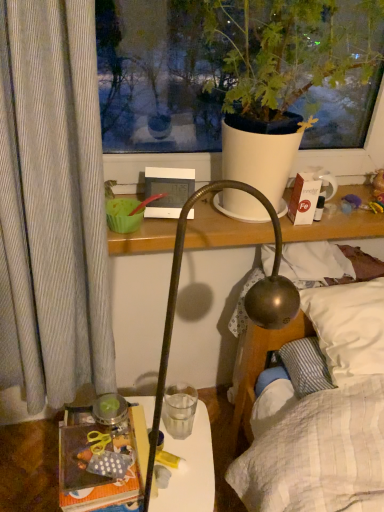
Question: Based on their positions, is transparent glass at center located to the left or right of polka dot fabric book at lower left?

Choices:
 (A) right
 (B) left

Answer: (A)

Question: Considering the positions of transparent glass at center and polka dot fabric book at lower left in the image, is transparent glass at center wider or thinner than polka dot fabric book at lower left?

Choices:
 (A) thin
 (B) wide

Answer: (A)

Question: Which object is the farthest from the polka dot fabric book at lower left?

Choices:
 (A) white cardboard box at upper right
 (B) white matte pot at upper center
 (C) white soft pillow at upper right
 (D) translucent plastic table at lower left
 (E) transparent glass at center

Answer: (B)

Question: Which object is positioned farthest from the polka dot fabric book at lower left?

Choices:
 (A) white cardboard box at upper right
 (B) transparent glass at center
 (C) white soft pillow at upper right
 (D) white matte pot at upper center
 (E) translucent plastic table at lower left

Answer: (D)